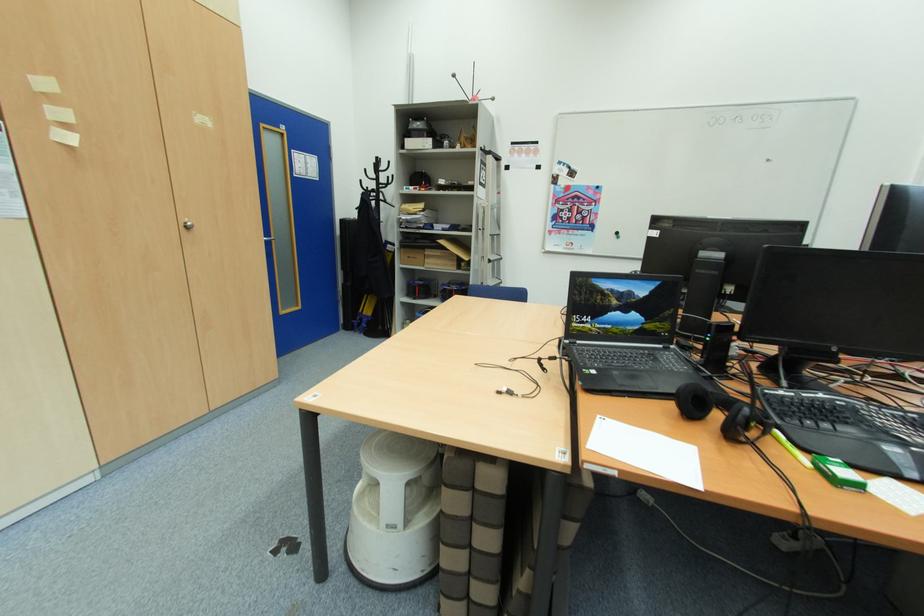
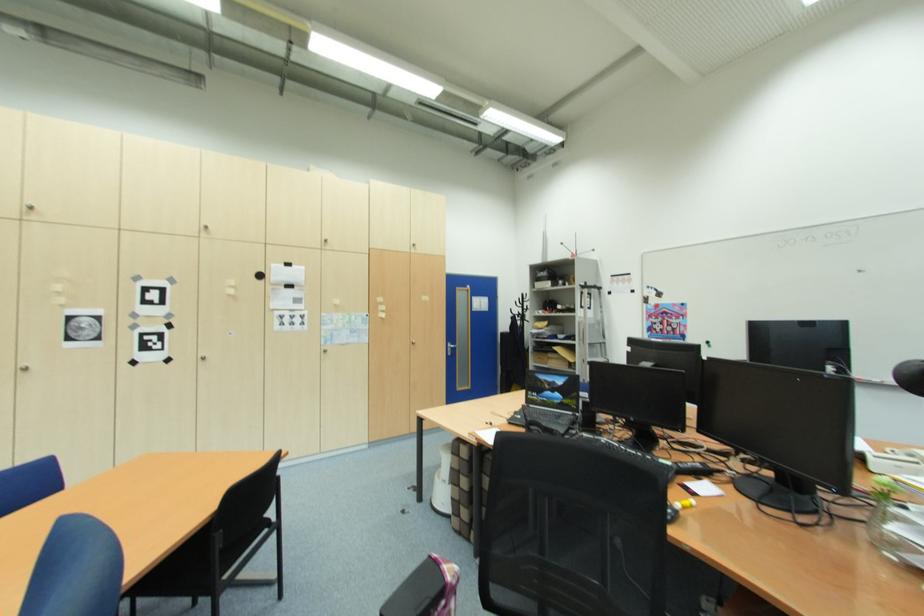
In the second image, find the point that corresponds to [476,197] in the first image.

(578, 317)